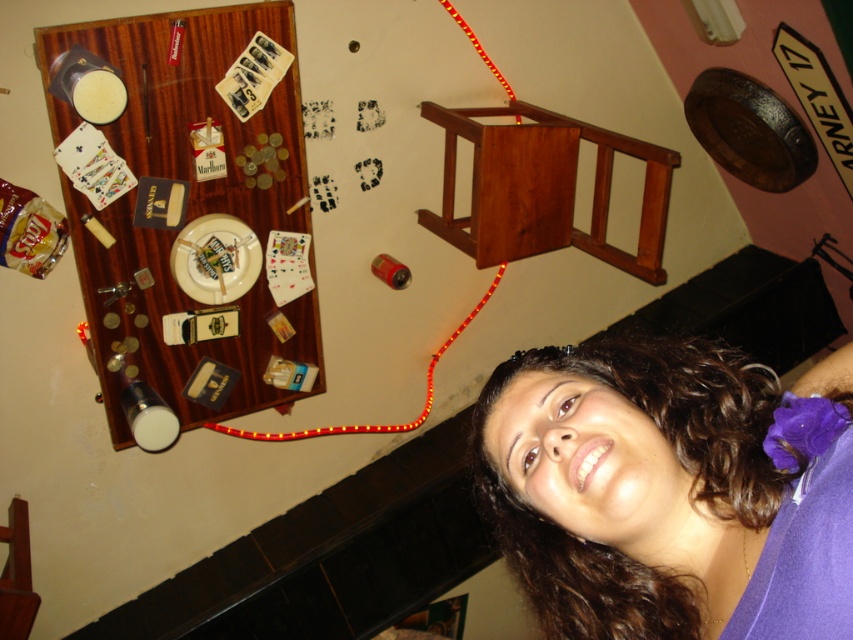
You are a photographer trying to adjust the lighting for a portrait. The subject has dark brown hair at upper right. Where exactly should you position the light source to ensure the hair is well lit?

To ensure the dark brown hair at upper right is well lit, position the light source near the upper right area corresponding to the coordinates point (670, 490).

You are a photographer adjusting lighting in the scene. You need to place a small reflector between the dark brown hair at upper right and the red led strip at center. Which object should the reflector be closer to to ensure proper lighting balance?

The reflector should be closer to the dark brown hair at upper right since it has a smaller width compared to the red led strip at center, requiring more focused lighting.

Looking at this image, you are a photographer standing in the bar and want to take a photo of the dark brown hair at upper right and the red led strip at center. Can you fit both objects in the same frame if your camera has a 1.5 meter field of view?

The dark brown hair at upper right and the red led strip at center are 1.28 meters apart. Since the distance between them is less than the camera field of view of 1.5 meters, both objects can be captured in the same frame.